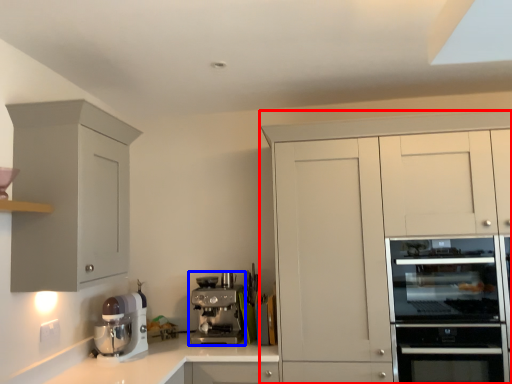
Question: Which object appears closest to the camera in this image, cabinetry (highlighted by a red box) or kitchen appliance (highlighted by a blue box)?

Choices:
 (A) cabinetry
 (B) kitchen appliance

Answer: (A)